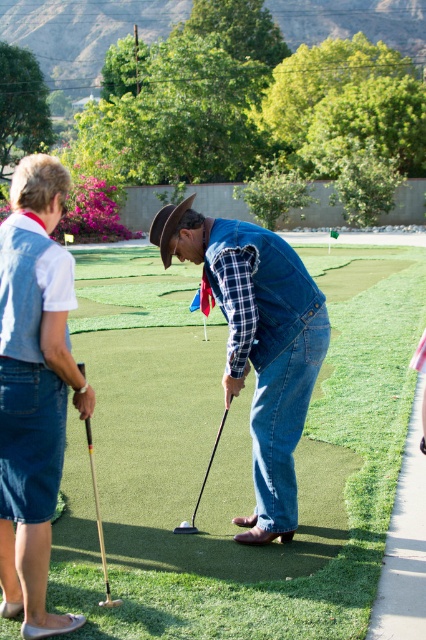
Question: Which object is closer to the camera taking this photo?

Choices:
 (A) black rubber golf club at center
 (B) denim/leather cowboy hat at center
 (C) wooden at left
 (D) green artificial turf at center

Answer: (D)

Question: Is green artificial turf at center behind wooden at left?

Choices:
 (A) no
 (B) yes

Answer: (A)

Question: Considering the real-world distances, which object is closest to the green artificial turf at center?

Choices:
 (A) black rubber golf club at center
 (B) denim/leather cowboy hat at center
 (C) wooden at left

Answer: (B)

Question: Considering the relative positions of denim/leather cowboy hat at center and black rubber golf club at center in the image provided, where is denim/leather cowboy hat at center located with respect to black rubber golf club at center?

Choices:
 (A) right
 (B) left

Answer: (A)

Question: Which point appears closest to the camera in this image?

Choices:
 (A) (290, 385)
 (B) (94, 470)
 (C) (192, 339)

Answer: (A)

Question: Does green artificial turf at center appear over black rubber golf club at center?

Choices:
 (A) yes
 (B) no

Answer: (A)